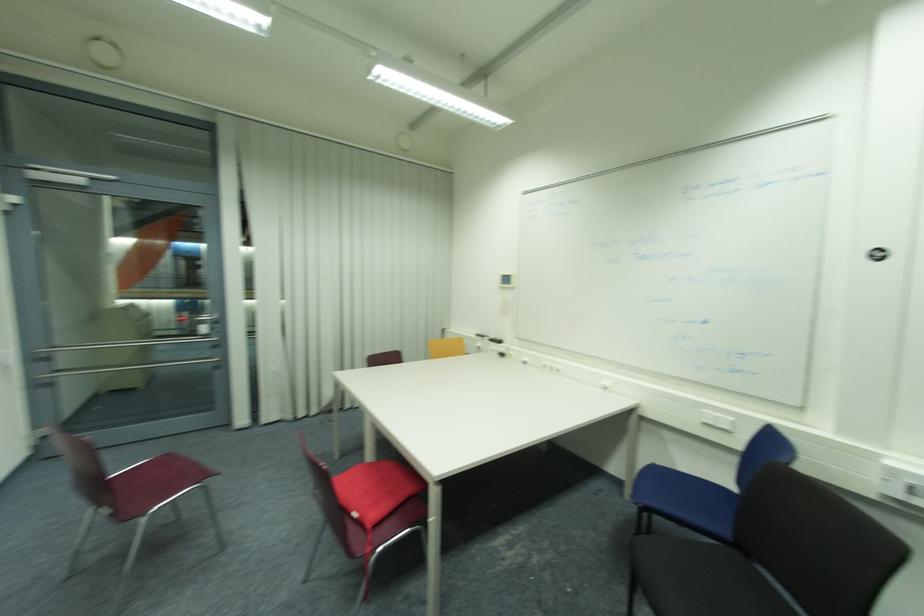
Which object does [375,487] point to?

This point indicates the red seat cushion.